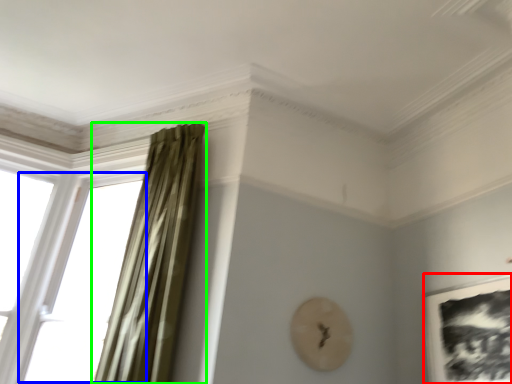
Question: Estimate the real-world distances between objects in this image. Which object is closer to picture frame (highlighted by a red box), window (highlighted by a blue box) or curtain (highlighted by a green box)?

Choices:
 (A) window
 (B) curtain

Answer: (B)